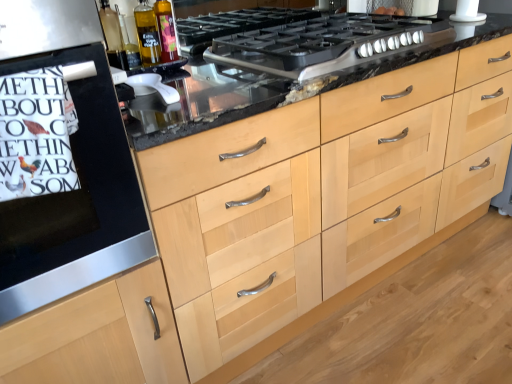
Question: Should I look upward or downward to see white plastic juicer at center, positioned as the first appliance in bottom-to-top order?

Choices:
 (A) up
 (B) down

Answer: (A)

Question: From a real-world perspective, is translucent glass bottle at upper left, which is the first bottle from right to left, located higher than white matte plastic pipe at upper right, positioned as the first appliance in top-to-bottom order?

Choices:
 (A) no
 (B) yes

Answer: (A)

Question: Does translucent glass bottle at upper left, the second bottle in the left-to-right sequence, have a smaller size compared to white matte plastic pipe at upper right, which is counted as the 2th appliance, starting from the front?

Choices:
 (A) no
 (B) yes

Answer: (B)

Question: Could you tell me if translucent glass bottle at upper left, which is the first bottle from right to left, is facing white matte plastic pipe at upper right, positioned as the first appliance in top-to-bottom order?

Choices:
 (A) yes
 (B) no

Answer: (B)

Question: Considering the relative positions of translucent glass bottle at upper left, which is the first bottle from right to left, and white matte plastic pipe at upper right, which is counted as the 2th appliance, starting from the front, in the image provided, is translucent glass bottle at upper left, which is the first bottle from right to left, in front of white matte plastic pipe at upper right, which is counted as the 2th appliance, starting from the front,?

Choices:
 (A) yes
 (B) no

Answer: (A)

Question: From the image's perspective, is translucent glass bottle at upper left, which is the first bottle from right to left, over white matte plastic pipe at upper right, arranged as the first appliance when viewed from the right?

Choices:
 (A) no
 (B) yes

Answer: (A)

Question: Is translucent glass bottle at upper left, the second bottle in the left-to-right sequence, to the left of white matte plastic pipe at upper right, which is counted as the 2th appliance, starting from the front, from the viewer's perspective?

Choices:
 (A) no
 (B) yes

Answer: (B)

Question: From a real-world perspective, is black matte gas stove at center over black matte oven at left?

Choices:
 (A) no
 (B) yes

Answer: (B)

Question: From a real-world perspective, is black matte gas stove at center located beneath black matte oven at left?

Choices:
 (A) no
 (B) yes

Answer: (A)

Question: Does black matte gas stove at center appear on the left side of black matte oven at left?

Choices:
 (A) no
 (B) yes

Answer: (A)

Question: Is black matte gas stove at center shorter than black matte oven at left?

Choices:
 (A) yes
 (B) no

Answer: (A)

Question: Does black matte gas stove at center have a greater width compared to black matte oven at left?

Choices:
 (A) no
 (B) yes

Answer: (A)

Question: From the image's perspective, does black matte gas stove at center appear lower than black matte oven at left?

Choices:
 (A) no
 (B) yes

Answer: (A)

Question: From the image's perspective, does white plastic juicer at center, which is the 2th appliance from back to front, appear lower than white matte plastic pipe at upper right, which is the 2th appliance in left-to-right order?

Choices:
 (A) no
 (B) yes

Answer: (B)